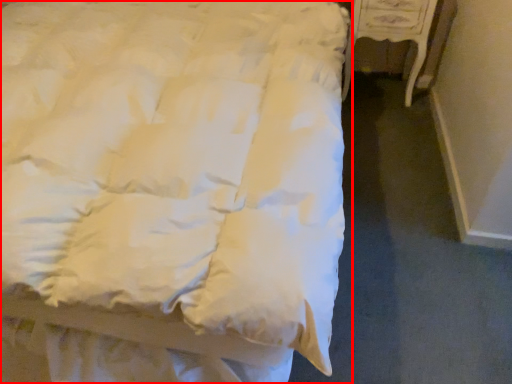
Question: From the image's perspective, what is the correct spatial relationship of bed (annotated by the red box) in relation to furniture?

Choices:
 (A) above
 (B) below

Answer: (B)